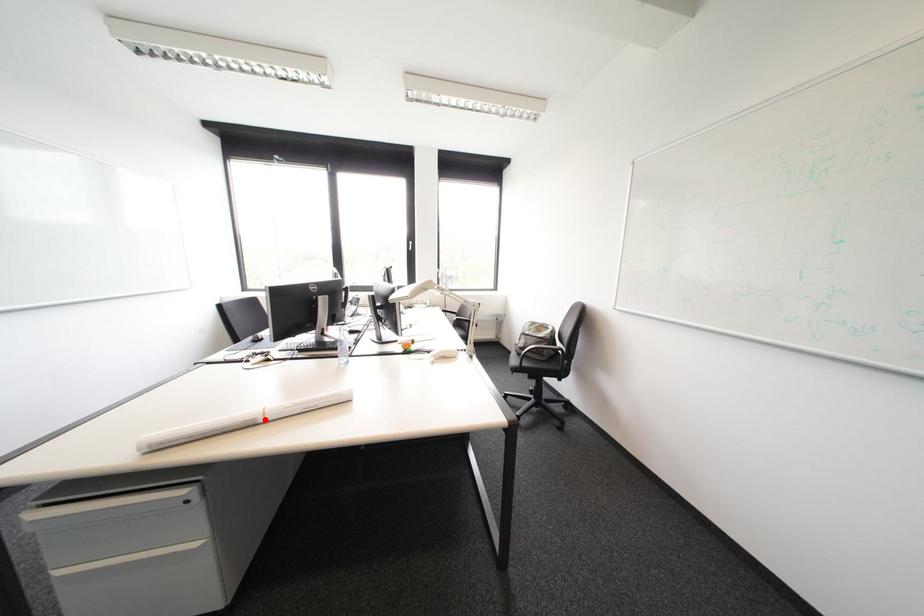
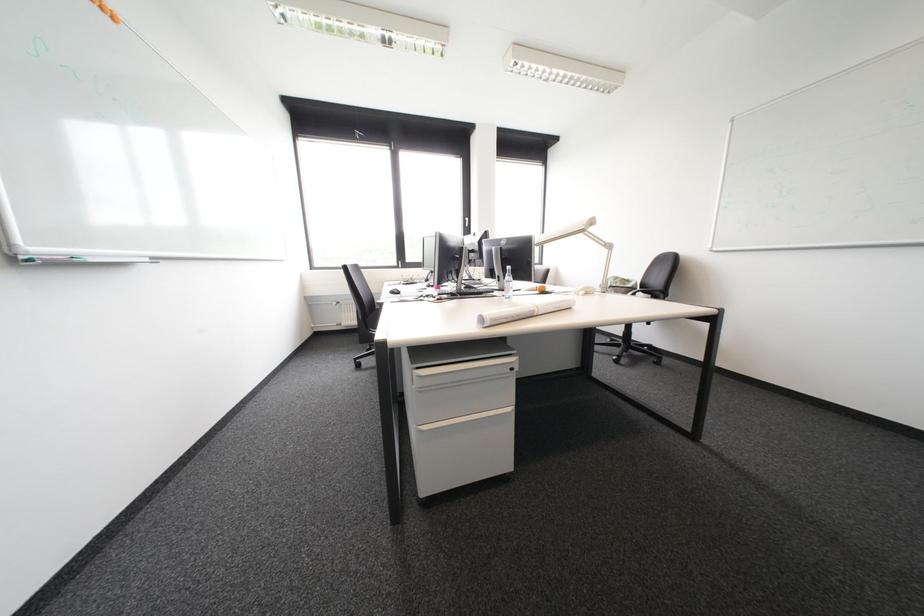
Where in the second image is the point corresponding to the highlighted location from the first image?

(543, 312)